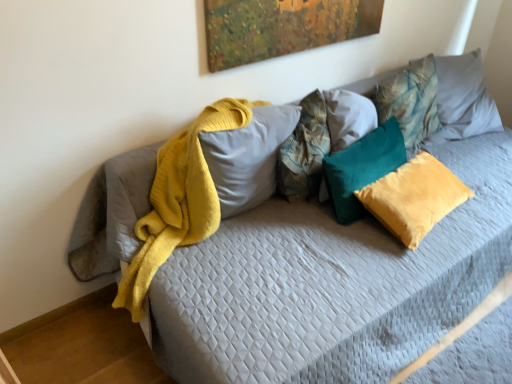
Question: Can you confirm if teal velvet pillow at center, which is the 2th pillow in right-to-left order, is positioned to the right of teal velvet pillow at upper right, marked as the 5th pillow in a left-to-right arrangement?

Choices:
 (A) no
 (B) yes

Answer: (A)

Question: Does teal velvet pillow at center, which is the 2th pillow in right-to-left order, have a greater height compared to teal velvet pillow at upper right, marked as the 5th pillow in a left-to-right arrangement?

Choices:
 (A) no
 (B) yes

Answer: (A)

Question: From a real-world perspective, does teal velvet pillow at center, which is the fourth pillow in left-to-right order, stand above teal velvet pillow at upper right, marked as the 5th pillow in a left-to-right arrangement?

Choices:
 (A) no
 (B) yes

Answer: (A)

Question: Is teal velvet pillow at center, which is the fourth pillow in left-to-right order, aimed at teal velvet pillow at upper right, positioned as the 1th pillow in right-to-left order?

Choices:
 (A) no
 (B) yes

Answer: (A)

Question: From a real-world perspective, is teal velvet pillow at center, which is the fourth pillow in left-to-right order, below teal velvet pillow at upper right, marked as the 5th pillow in a left-to-right arrangement?

Choices:
 (A) yes
 (B) no

Answer: (A)

Question: Would you say teal velvet pillow at center, which is the 2th pillow in right-to-left order, is outside teal velvet pillow at upper right, marked as the 5th pillow in a left-to-right arrangement?

Choices:
 (A) no
 (B) yes

Answer: (B)

Question: Is textured teal pillow at center, which is counted as the fourth pillow, starting from the right, closer to the viewer compared to teal velvet pillow at center, acting as the 3th pillow starting from the right?

Choices:
 (A) no
 (B) yes

Answer: (B)

Question: Is textured teal pillow at center, the 2th pillow viewed from the left, shorter than teal velvet pillow at center, acting as the 3th pillow starting from the right?

Choices:
 (A) yes
 (B) no

Answer: (B)

Question: Would you consider textured teal pillow at center, which is counted as the fourth pillow, starting from the right, to be distant from teal velvet pillow at center, acting as the 3th pillow starting from the right?

Choices:
 (A) no
 (B) yes

Answer: (A)

Question: From a real-world perspective, does textured teal pillow at center, the 2th pillow viewed from the left, sit lower than teal velvet pillow at center, acting as the 3th pillow starting from the right?

Choices:
 (A) no
 (B) yes

Answer: (A)

Question: Considering the relative sizes of textured teal pillow at center, which is counted as the fourth pillow, starting from the right, and teal velvet pillow at center, the third pillow positioned from the left, in the image provided, is textured teal pillow at center, which is counted as the fourth pillow, starting from the right, thinner than teal velvet pillow at center, the third pillow positioned from the left,?

Choices:
 (A) yes
 (B) no

Answer: (B)

Question: Is textured teal pillow at center, which is counted as the fourth pillow, starting from the right, beside teal velvet pillow at center, acting as the 3th pillow starting from the right?

Choices:
 (A) no
 (B) yes

Answer: (A)

Question: From the image's perspective, does teal velvet pillow at center, the third pillow positioned from the left, appear lower than soft yellow fabric pillow at center, the 1th pillow from the left?

Choices:
 (A) yes
 (B) no

Answer: (A)